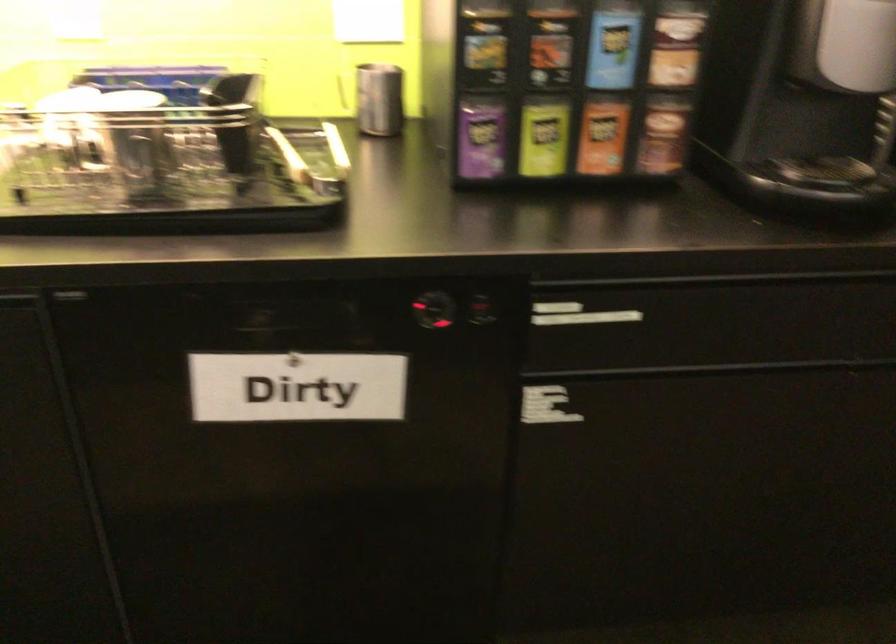
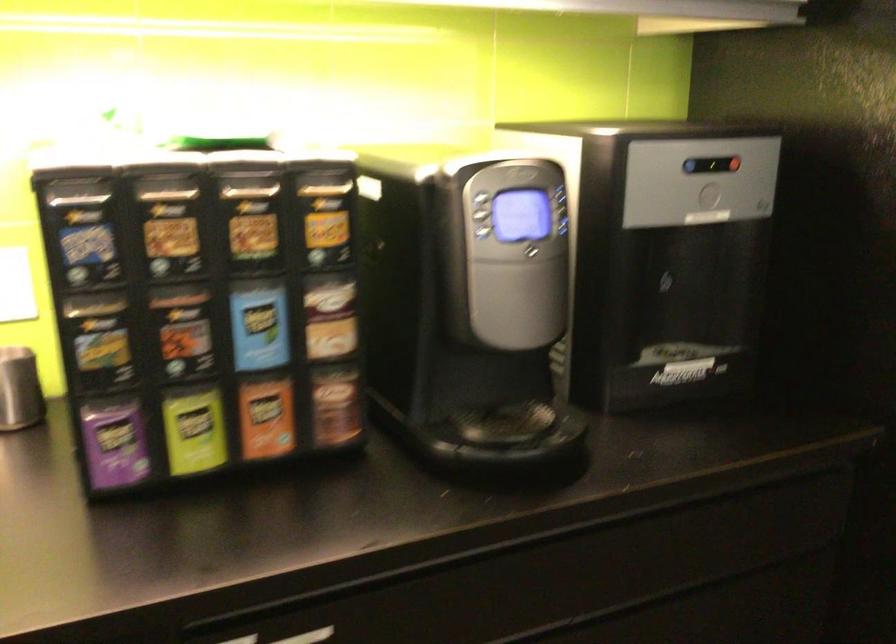
Where in the second image is the point corresponding to point 543,137 from the first image?

(194, 430)